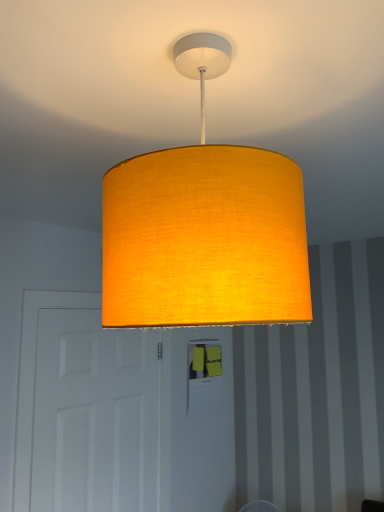
At what (x,y) coordinates should I click in order to perform the action: click on matte yellow fabric lampshade at center. Please return your answer as a coordinate pair (x, y). The width and height of the screenshot is (384, 512). Looking at the image, I should click on (204, 227).

The image size is (384, 512). What do you see at coordinates (204, 227) in the screenshot?
I see `matte yellow fabric lampshade at center` at bounding box center [204, 227].

Locate an element on the screen. Image resolution: width=384 pixels, height=512 pixels. matte yellow fabric lampshade at center is located at coordinates (204, 227).